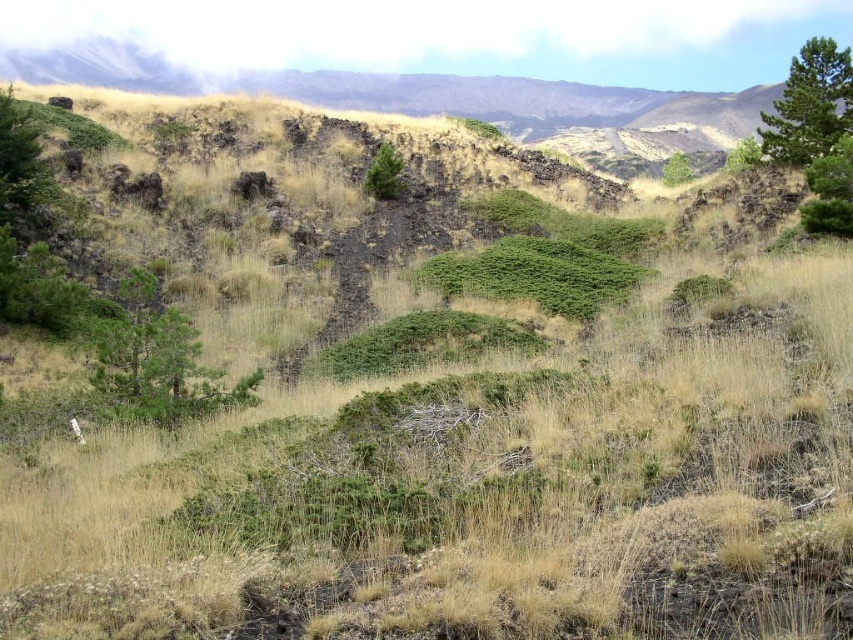
Is point (851, 58) farther from camera compared to point (393, 163)?

No, (851, 58) is closer to viewer.

Is point (827, 72) behind point (364, 188)?

No, (827, 72) is closer to viewer.

The image size is (853, 640). Find the location of `green textured tree at upper right`. green textured tree at upper right is located at coordinates (810, 104).

Which is in front, point (399, 163) or point (682, 173)?

Point (399, 163) is more forward.

This screenshot has height=640, width=853. What are the coordinates of `green textured tree at center` in the screenshot? It's located at (384, 173).

Find the location of a particular element. green textured tree at center is located at coordinates (384, 173).

Which is in front, point (816, 68) or point (815, 214)?

Point (815, 214) is in front.

Is green textured tree at upper right shorter than green leafy tree at right?

In fact, green textured tree at upper right may be taller than green leafy tree at right.

What do you see at coordinates (810, 104) in the screenshot? Image resolution: width=853 pixels, height=640 pixels. I see `green textured tree at upper right` at bounding box center [810, 104].

Where is `green textured tree at upper right`? This screenshot has width=853, height=640. green textured tree at upper right is located at coordinates (810, 104).